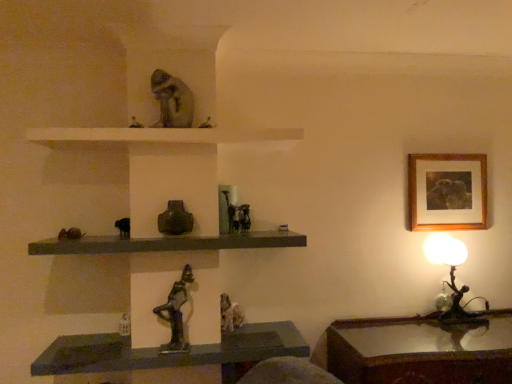
The image size is (512, 384). Describe the element at coordinates (172, 100) in the screenshot. I see `matte stone chameleon at upper center, the first animal viewed from the top` at that location.

What do you see at coordinates (175, 219) in the screenshot?
I see `green glass vase at center` at bounding box center [175, 219].

This screenshot has height=384, width=512. I want to click on wooden table at lower right, so click(421, 350).

What do you see at coordinates (168, 243) in the screenshot? The width and height of the screenshot is (512, 384). I see `matte dark gray shelf at center, which is counted as the first shelf, starting from the bottom` at bounding box center [168, 243].

The height and width of the screenshot is (384, 512). I want to click on white matte shelf at upper center, the second shelf from the bottom, so click(x=164, y=135).

How different are the orientations of matte dark gray shelf at center, which is counted as the first shelf, starting from the bottom, and metallic statue at center, the second animal positioned from the top, in degrees?

The angle between the facing direction of matte dark gray shelf at center, which is counted as the first shelf, starting from the bottom, and the facing direction of metallic statue at center, the second animal positioned from the top, is 1.36 degrees.

Is matte dark gray shelf at center, the second shelf positioned from the top, positioned with its back to metallic statue at center, positioned as the third animal in bottom-to-top order?

No.

Which object is wider, matte dark gray shelf at center, which is counted as the first shelf, starting from the bottom, or metallic statue at center, positioned as the third animal in bottom-to-top order?

matte dark gray shelf at center, which is counted as the first shelf, starting from the bottom, is wider.

Which is farther from the camera, [51,254] or [229,206]?

The point [229,206] is farther.

Based on the photo, from a real-world perspective, is metallic bronze figurine at right positioned above or below bronze statue at center, which is the 2th animal from bottom to top?

In terms of real-world spatial position, metallic bronze figurine at right is below bronze statue at center, which is the 2th animal from bottom to top.

Locate an element on the screen. The height and width of the screenshot is (384, 512). animal that is the 3rd one when counting leftward from the metallic bronze figurine at right is located at coordinates (176, 312).

From the image's perspective, does metallic bronze figurine at right appear lower than bronze statue at center, positioned as the third animal in top-to-bottom order?

Actually, metallic bronze figurine at right appears above bronze statue at center, positioned as the third animal in top-to-bottom order, in the image.

Which is farther from the camera, (x=456, y=306) or (x=185, y=274)?

The point (x=456, y=306) is more distant.

Is rustic stone figurine at center, the 1th animal when ordered from bottom to top, not within matte stone chameleon at upper center, which appears as the 4th animal when ordered from the bottom?

Indeed, rustic stone figurine at center, the 1th animal when ordered from bottom to top, is completely outside matte stone chameleon at upper center, which appears as the 4th animal when ordered from the bottom.

Considering the relative positions of rustic stone figurine at center, which is the 4th animal in top-to-bottom order, and matte stone chameleon at upper center, which appears as the 4th animal when ordered from the bottom, in the image provided, is rustic stone figurine at center, which is the 4th animal in top-to-bottom order, behind matte stone chameleon at upper center, which appears as the 4th animal when ordered from the bottom,?

Yes, the depth of rustic stone figurine at center, which is the 4th animal in top-to-bottom order, is greater than that of matte stone chameleon at upper center, which appears as the 4th animal when ordered from the bottom.

Is rustic stone figurine at center, which is the 4th animal in top-to-bottom order, facing away from matte stone chameleon at upper center, which appears as the 4th animal when ordered from the bottom?

No, matte stone chameleon at upper center, which appears as the 4th animal when ordered from the bottom, is not at the back of rustic stone figurine at center, which is the 4th animal in top-to-bottom order.

Find the location of a particular element. The width and height of the screenshot is (512, 384). the 3rd animal behind the matte stone chameleon at upper center, which appears as the 4th animal when ordered from the bottom, starting your count from the anchor is located at coordinates (230, 314).

Looking at this image, is metallic statue at center oriented away from matte dark gray shelf at center, the second shelf positioned from the top?

No, matte dark gray shelf at center, the second shelf positioned from the top, is not at the back of metallic statue at center.

Is matte dark gray shelf at center, the second shelf positioned from the top, completely or partially inside metallic statue at center?

No, matte dark gray shelf at center, the second shelf positioned from the top, is not a part of metallic statue at center.

This screenshot has width=512, height=384. What are the coordinates of `vanity on the right of the matte dark gray shelf at center, the second shelf positioned from the top` in the screenshot? It's located at (168, 354).

Is metallic statue at center oriented towards green glass vase at center?

No, metallic statue at center is not facing towards green glass vase at center.

Between metallic statue at center and green glass vase at center, which one has more height?

green glass vase at center.

Does point (259, 326) come farther from viewer compared to point (159, 215)?

Yes, it is behind point (159, 215).

Does metallic statue at center have a larger size compared to green glass vase at center?

Yes, metallic statue at center is bigger than green glass vase at center.

Considering their positions, is wooden table at lower right located in front of or behind bronze statue at center, which is the 2th animal from bottom to top?

wooden table at lower right is in front of bronze statue at center, which is the 2th animal from bottom to top.

Is wooden table at lower right positioned beyond the bounds of bronze statue at center, which is the 2th animal from bottom to top?

Yes, wooden table at lower right is located beyond the bounds of bronze statue at center, which is the 2th animal from bottom to top.

Considering the sizes of objects wooden table at lower right and bronze statue at center, which is the 2th animal from bottom to top, in the image provided, who is wider, wooden table at lower right or bronze statue at center, which is the 2th animal from bottom to top,?

Wider between the two is wooden table at lower right.

In the scene shown: How distant is wooden table at lower right from bronze statue at center, which is the 2th animal from bottom to top?

wooden table at lower right is 3.41 feet from bronze statue at center, which is the 2th animal from bottom to top.

From the image's perspective, which is above, green glass vase at center or matte dark gray shelf at center, the second shelf positioned from the top?

green glass vase at center appears higher in the image.

Considering the relative positions of green glass vase at center and matte dark gray shelf at center, which is counted as the first shelf, starting from the bottom, in the image provided, is green glass vase at center to the right of matte dark gray shelf at center, which is counted as the first shelf, starting from the bottom, from the viewer's perspective?

Indeed, green glass vase at center is positioned on the right side of matte dark gray shelf at center, which is counted as the first shelf, starting from the bottom.

Considering the sizes of objects green glass vase at center and matte dark gray shelf at center, which is counted as the first shelf, starting from the bottom, in the image provided, who is shorter, green glass vase at center or matte dark gray shelf at center, which is counted as the first shelf, starting from the bottom,?

Standing shorter between the two is matte dark gray shelf at center, which is counted as the first shelf, starting from the bottom.

From a real-world perspective, is green glass vase at center on top of matte dark gray shelf at center, which is counted as the first shelf, starting from the bottom?

Yes, from a real-world perspective, green glass vase at center is over matte dark gray shelf at center, which is counted as the first shelf, starting from the bottom

Where is `the 2nd shelf in front of the metallic statue at center, positioned as the third animal in bottom-to-top order`? The width and height of the screenshot is (512, 384). the 2nd shelf in front of the metallic statue at center, positioned as the third animal in bottom-to-top order is located at coordinates (168, 243).

Which animal is the 3rd one when counting from the left side of the metallic bronze figurine at right? Please provide its 2D coordinates.

[(176, 312)]

Considering their positions, is metallic statue at center positioned further to matte stone chameleon at upper center, which appears as the 4th animal when ordered from the bottom, than matte dark gray shelf at center, the second shelf positioned from the top?

metallic statue at center lies further to matte stone chameleon at upper center, which appears as the 4th animal when ordered from the bottom, than the other object.

When comparing their distances from bronze statue at center, positioned as the third animal in top-to-bottom order, does metallic bronze figurine at right or matte stone chameleon at upper center, the first animal viewed from the top, seem closer?

matte stone chameleon at upper center, the first animal viewed from the top, lies closer to bronze statue at center, positioned as the third animal in top-to-bottom order, than the other object.

Which object lies further to the anchor point metallic statue at center, positioned as the third animal in bottom-to-top order, matte stone chameleon at upper center, the first animal viewed from the top, or white matte shelf at upper center, the second shelf from the bottom?

matte stone chameleon at upper center, the first animal viewed from the top.

Considering their positions, is metallic statue at center, positioned as the third animal in bottom-to-top order, positioned further to matte dark gray shelf at center, which is counted as the first shelf, starting from the bottom, than green glass vase at center?

The object further to matte dark gray shelf at center, which is counted as the first shelf, starting from the bottom, is metallic statue at center, positioned as the third animal in bottom-to-top order.

Considering their positions, is wooden framed print at upper right positioned closer to wooden table at lower right than white matte shelf at upper center, the first shelf in the top-to-bottom sequence?

Among the two, wooden framed print at upper right is located nearer to wooden table at lower right.

Estimate the real-world distances between objects in this image. Which object is closer to metallic bronze figurine at right, green glass vase at center or matte dark gray shelf at center, which is counted as the first shelf, starting from the bottom?

matte dark gray shelf at center, which is counted as the first shelf, starting from the bottom.

Looking at the image, which one is located closer to matte stone chameleon at upper center, which appears as the 4th animal when ordered from the bottom, matte dark gray shelf at center, which is counted as the first shelf, starting from the bottom, or metallic statue at center?

Based on the image, matte dark gray shelf at center, which is counted as the first shelf, starting from the bottom, appears to be nearer to matte stone chameleon at upper center, which appears as the 4th animal when ordered from the bottom.

Which object lies further to the anchor point rustic stone figurine at center, the 1th animal when ordered from bottom to top, white matte shelf at upper center, the second shelf from the bottom, or green glass vase at center?

white matte shelf at upper center, the second shelf from the bottom.

The height and width of the screenshot is (384, 512). I want to click on animal between white matte shelf at upper center, the first shelf in the top-to-bottom sequence, and bronze statue at center, positioned as the third animal in top-to-bottom order, from top to bottom, so click(x=237, y=215).

Locate an element on the screen. vanity between white matte shelf at upper center, the first shelf in the top-to-bottom sequence, and wooden framed print at upper right from left to right is located at coordinates (168, 354).

Where is `glass vase between metallic statue at center, the second animal positioned from the top, and rustic stone figurine at center, which is the 4th animal in top-to-bottom order, in the vertical direction`? glass vase between metallic statue at center, the second animal positioned from the top, and rustic stone figurine at center, which is the 4th animal in top-to-bottom order, in the vertical direction is located at coordinates (175, 219).

Find the location of a particular element. This screenshot has height=384, width=512. table between rustic stone figurine at center, the 1th animal when ordered from bottom to top, and metallic bronze figurine at right, in the horizontal direction is located at coordinates (421, 350).